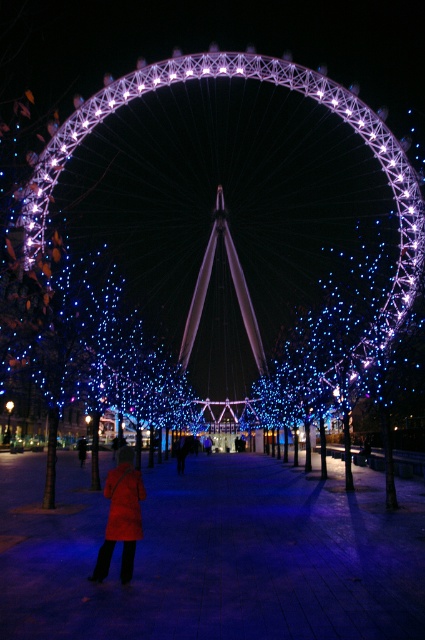
You are standing on the paved walkway and want to take a photo of both the illuminated steel ferris wheel at center and the red wool coat at center. Which object should you focus on first to ensure both are in the frame?

The illuminated steel ferris wheel at center might be wider than the red wool coat at center, so you should focus on the illuminated steel ferris wheel at center first to ensure both are in the frame.

You are standing on the walkway near the illuminated steel ferris wheel at center and the red wool coat at center. If you look upward, which object will you see first?

The illuminated steel ferris wheel at center is located above the red wool coat at center, so you will see the illuminated steel ferris wheel at center first when looking upward.